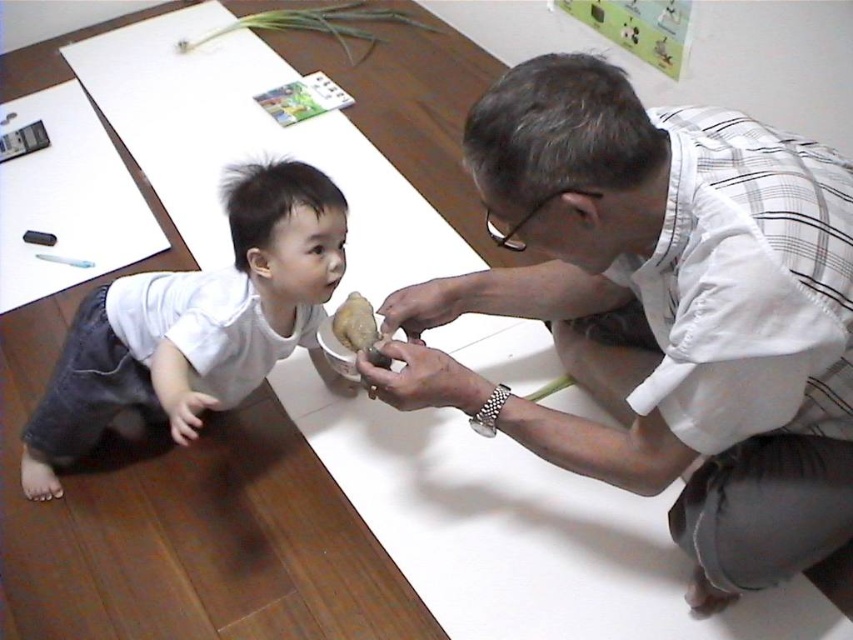
You are a delivery robot that needs to place a package on the table. The package is 16 inches wide. There is a white checkered shirt at upper right and a slightly translucent white food at center on the table. Can the package fit between them without touching either?

The white checkered shirt at upper right is 16.39 inches away from the slightly translucent white food at center. Since the package is 16 inches wide, it can fit between them as the distance is slightly more than the package width.

You are a photographer standing at the camera position. You want to take a closeup shot of the object at point (817, 394) and also capture the object at point (352, 323) in the background. Is this possible?

Yes, because point (817, 394) is closer to the camera than point (352, 323), so you can focus on the closer object while having the farther one in the background.